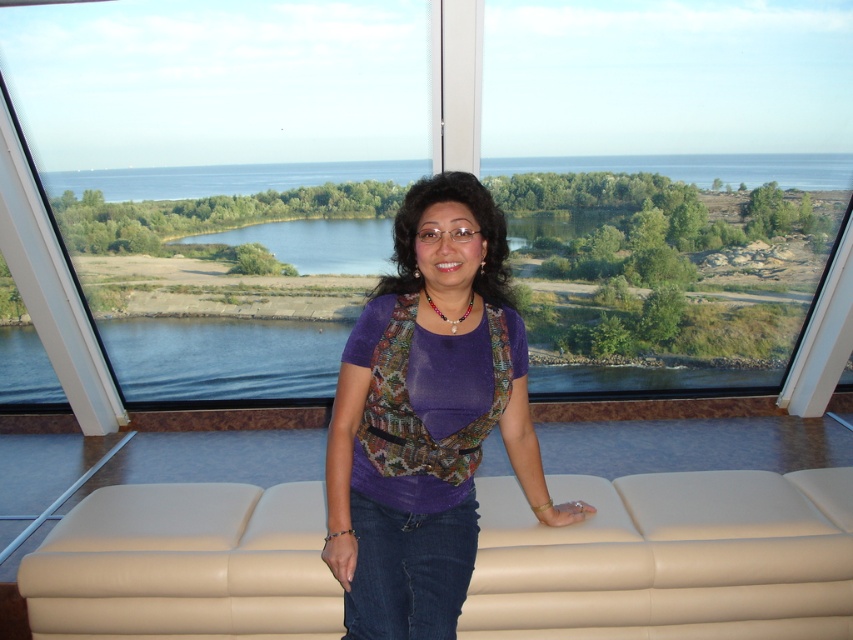
The woman is looking at the scenic view outside. Is the transparent glass window at center positioned higher than the purple fabric top at center?

Yes, the transparent glass window at center is above purple fabric top at center, so it is positioned higher.

You are a photographer trying to capture the woman in the purple fabric top at center through the transparent glass window at center. Considering the sizes of both objects, will the window be wide enough to frame the entire top?

The transparent glass window at center is wider than the purple fabric top at center, so yes, the window will be wide enough to frame the entire top.